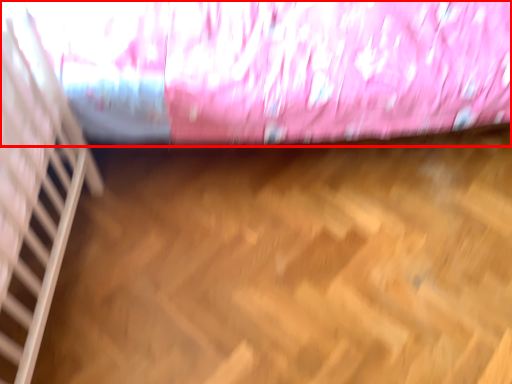
Question: From the image's perspective, where is curtain (annotated by the red box) located relative to stairwell?

Choices:
 (A) above
 (B) below

Answer: (A)